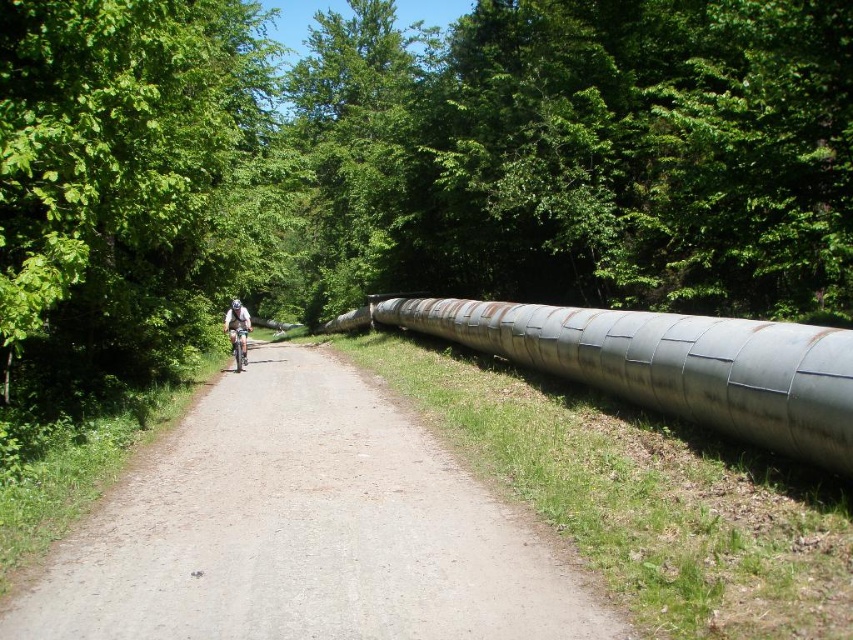
Question: Estimate the real-world distances between objects in this image. Which object is closer to the white matte bicycle helmet at center?

Choices:
 (A) light blue fabric helmet at center
 (B) gray gravel path at center

Answer: (A)

Question: Is silver metallic bicycle at center bigger than white matte bicycle helmet at center?

Choices:
 (A) yes
 (B) no

Answer: (B)

Question: Can you confirm if light blue fabric helmet at center is thinner than white matte bicycle helmet at center?

Choices:
 (A) no
 (B) yes

Answer: (A)

Question: Is silver metallic bicycle at center to the left of white matte bicycle helmet at center from the viewer's perspective?

Choices:
 (A) no
 (B) yes

Answer: (A)

Question: Which object is positioned farthest from the light blue fabric helmet at center?

Choices:
 (A) gray gravel path at center
 (B) white matte bicycle helmet at center

Answer: (A)

Question: Which point is farther to the camera?

Choices:
 (A) (234, 330)
 (B) (233, 305)

Answer: (B)